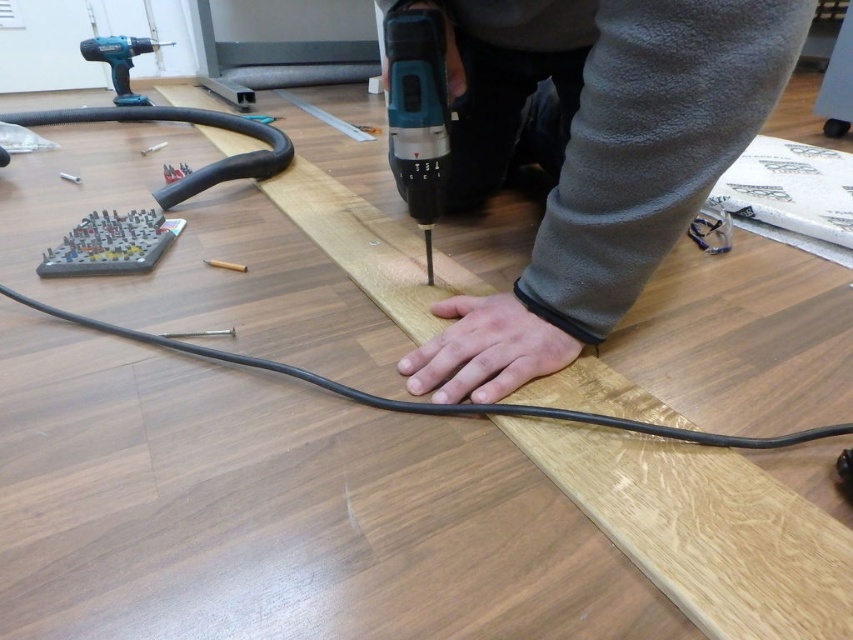
Does plastic game board at upper left lie in front of wooden pencil at center?

Yes, it is.

Does plastic game board at upper left appear on the left side of wooden pencil at center?

Yes, plastic game board at upper left is to the left of wooden pencil at center.

The image size is (853, 640). I want to click on plastic game board at upper left, so click(x=109, y=244).

Can you confirm if smooth skin hand at center is smaller than gray matte hand at center?

Actually, smooth skin hand at center might be larger than gray matte hand at center.

Is smooth skin hand at center shorter than gray matte hand at center?

→ No, smooth skin hand at center is not shorter than gray matte hand at center.

Find the location of a particular element. Image resolution: width=853 pixels, height=640 pixels. smooth skin hand at center is located at coordinates (485, 349).

Is blue plastic drill at center thinner than metallic drill bit at center?

No, blue plastic drill at center is not thinner than metallic drill bit at center.

Between point (384, 19) and point (160, 148), which one is positioned behind?

Positioned behind is point (160, 148).

Image resolution: width=853 pixels, height=640 pixels. I want to click on blue plastic drill at center, so click(x=418, y=113).